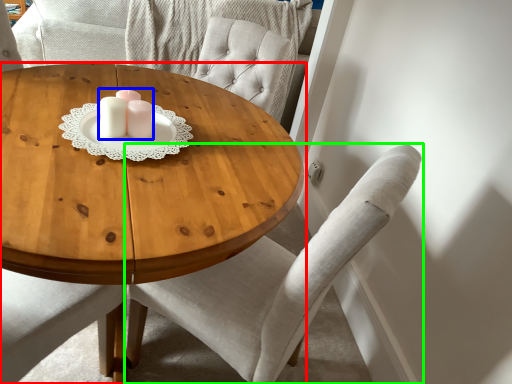
Question: Which object is the farthest from coffee table (highlighted by a red box)? Choose among these: candle holder (highlighted by a blue box) or chair (highlighted by a green box).

Choices:
 (A) candle holder
 (B) chair

Answer: (B)